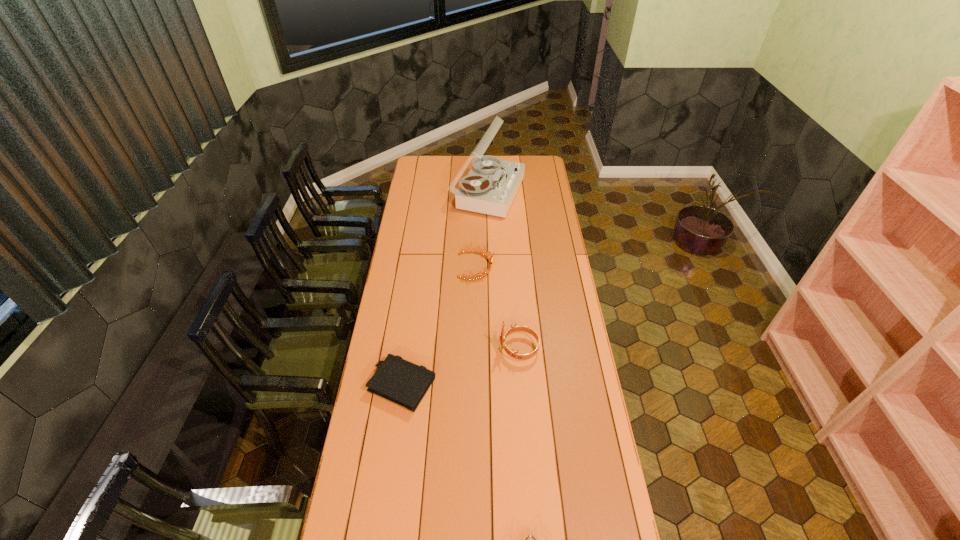
In the image, there is a desktop. Where is `free space at the far right corner`? free space at the far right corner is located at coordinates (539, 159).

Locate an element on the screen. blank region between the second shortest tiara and the tallest tiara is located at coordinates (497, 307).

Where is `unoccupied area between the Bible and the tallest object`? The width and height of the screenshot is (960, 540). unoccupied area between the Bible and the tallest object is located at coordinates (445, 289).

You are a GUI agent. You are given a task and a screenshot of the screen. Output one action in this format:
    pyautogui.click(x=<x>, y=<y>)
    Task: Click on the vacant space that is in between the Bible and the record player
    The height and width of the screenshot is (540, 960).
    Given the screenshot: What is the action you would take?
    pyautogui.click(x=445, y=289)

The height and width of the screenshot is (540, 960). Find the location of `vacant space that is in between the second farthest tiara and the second farthest object`. vacant space that is in between the second farthest tiara and the second farthest object is located at coordinates (497, 307).

At what (x,y) coordinates should I click in order to perform the action: click on empty location between the second farthest object and the record player. Please return your answer as a coordinate pair (x, y). The width and height of the screenshot is (960, 540). Looking at the image, I should click on (482, 229).

Find the location of `free space between the second tallest tiara and the tallest object`. free space between the second tallest tiara and the tallest object is located at coordinates (482, 229).

Where is `object that can be found as the closest to the second shortest tiara`? This screenshot has width=960, height=540. object that can be found as the closest to the second shortest tiara is located at coordinates (490, 187).

Identify the location of object that is the third closest to the nearest object. (486, 255).

This screenshot has width=960, height=540. What are the coordinates of `tiara that stands as the second closest to the nearest object` in the screenshot? It's located at (486, 255).